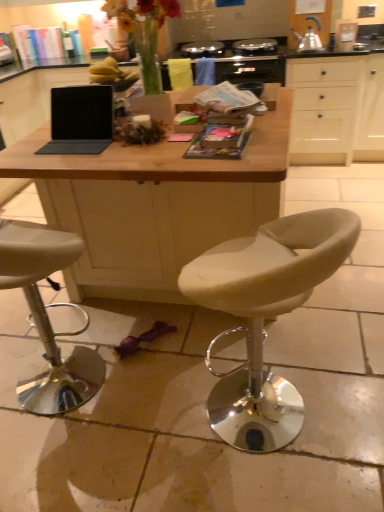
Locate an element on the screen. vacant space in between beige leather stool at lower left, which ranks as the second chair in right-to-left order, and white leather stool at center, which is the second chair in left-to-right order is located at coordinates (159, 406).